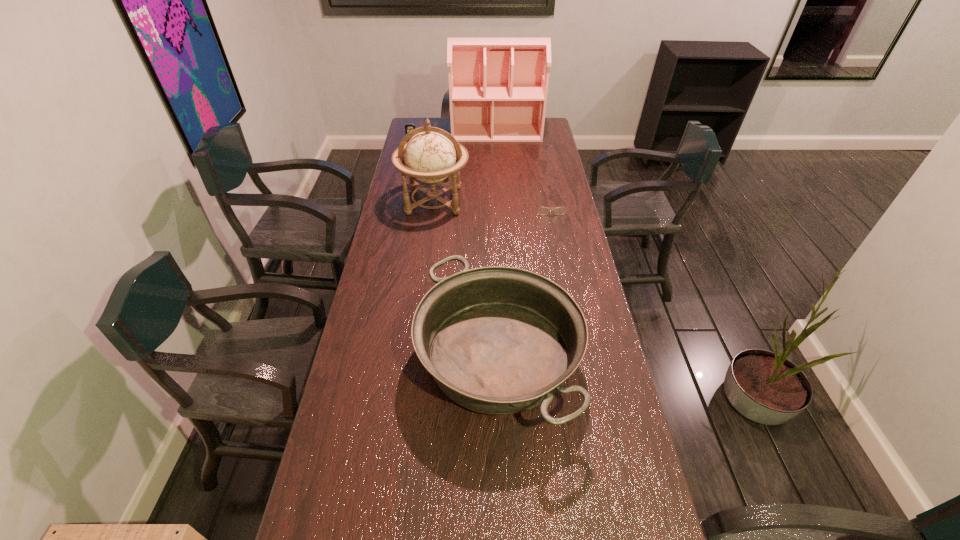
The width and height of the screenshot is (960, 540). Identify the location of vacant space located on the right of the nearest object. (599, 357).

The width and height of the screenshot is (960, 540). I want to click on vacant space located 0.250m on the screen of the fourth tallest object, so click(406, 173).

Image resolution: width=960 pixels, height=540 pixels. Identify the location of free space located 0.350m on the front-facing side of the spectacles. (563, 274).

Identify the location of object situated at the far edge. Image resolution: width=960 pixels, height=540 pixels. (498, 87).

At what (x,y) coordinates should I click in order to perform the action: click on globe at the left edge. Please return your answer as a coordinate pair (x, y). The width and height of the screenshot is (960, 540). Looking at the image, I should click on (432, 156).

At what (x,y) coordinates should I click in order to perform the action: click on cellular telephone that is positioned at the left edge. Please return your answer as a coordinate pair (x, y). The width and height of the screenshot is (960, 540). Looking at the image, I should click on (408, 127).

Where is `dollhouse situated at the right edge`? dollhouse situated at the right edge is located at coordinates (498, 87).

At what (x,y) coordinates should I click in order to perform the action: click on pan present at the right edge. Please return your answer as a coordinate pair (x, y). Image resolution: width=960 pixels, height=540 pixels. Looking at the image, I should click on (497, 340).

This screenshot has width=960, height=540. Identify the location of spectacles located at the right edge. (541, 210).

Where is `object present at the far right corner`? The height and width of the screenshot is (540, 960). object present at the far right corner is located at coordinates (498, 87).